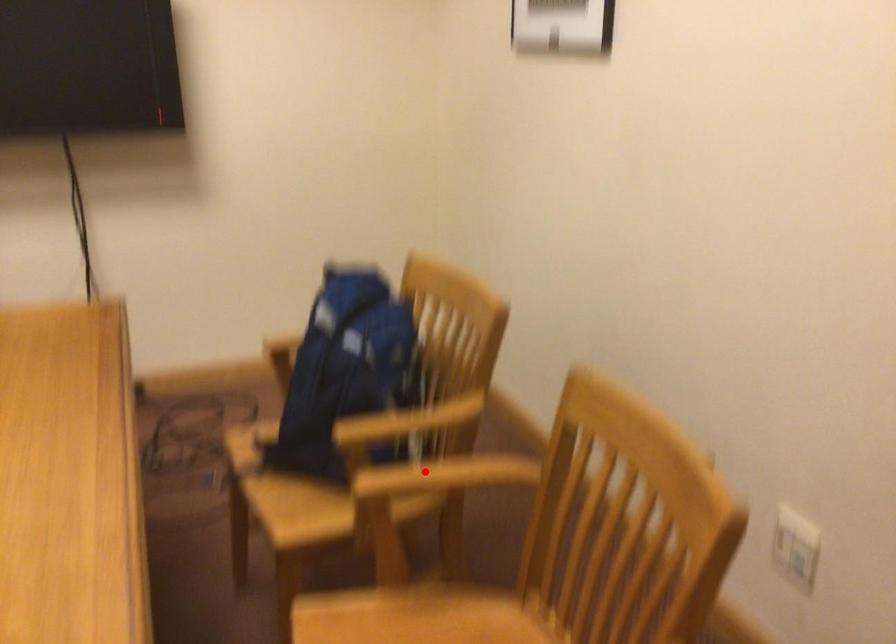
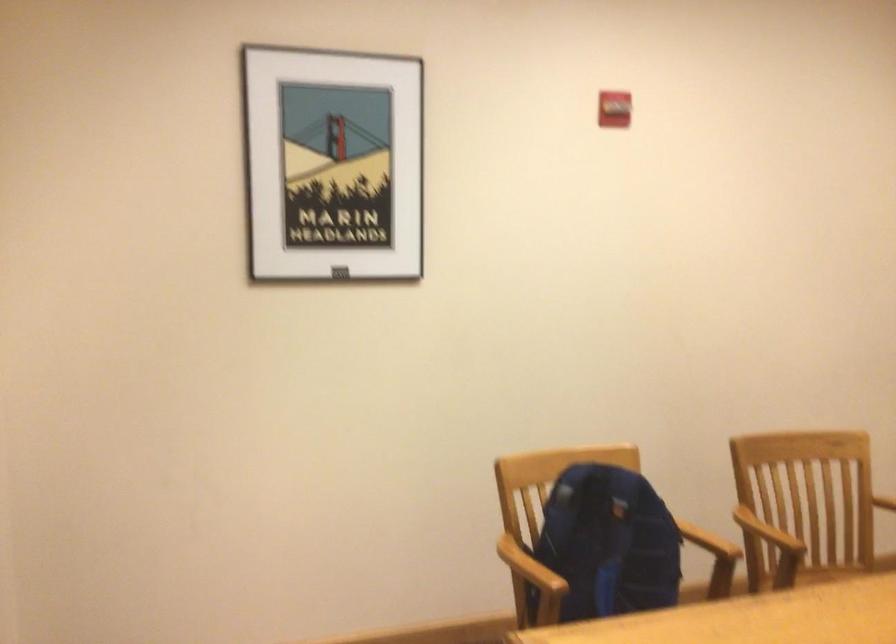
Find the pixel in the second image that matches the highlighted location in the first image.

(767, 532)